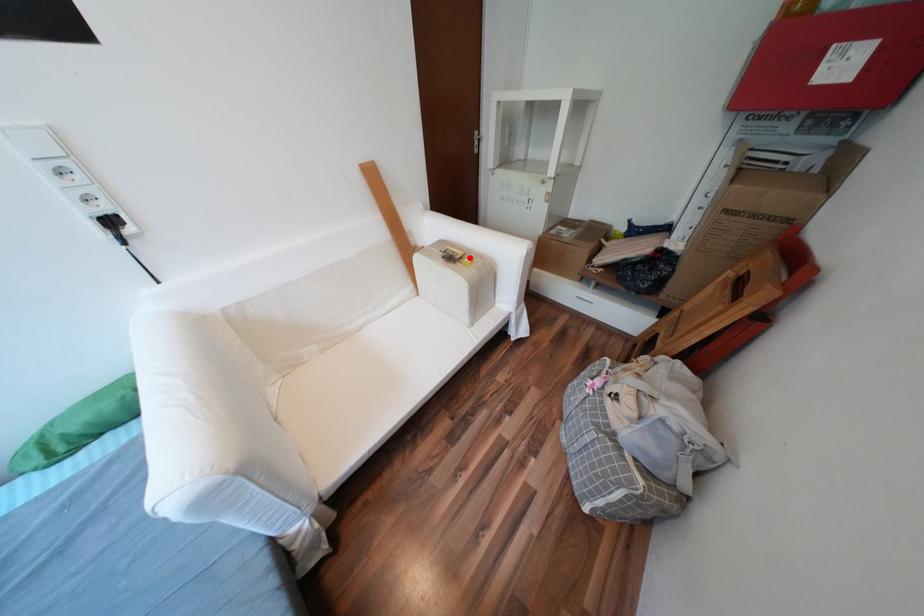
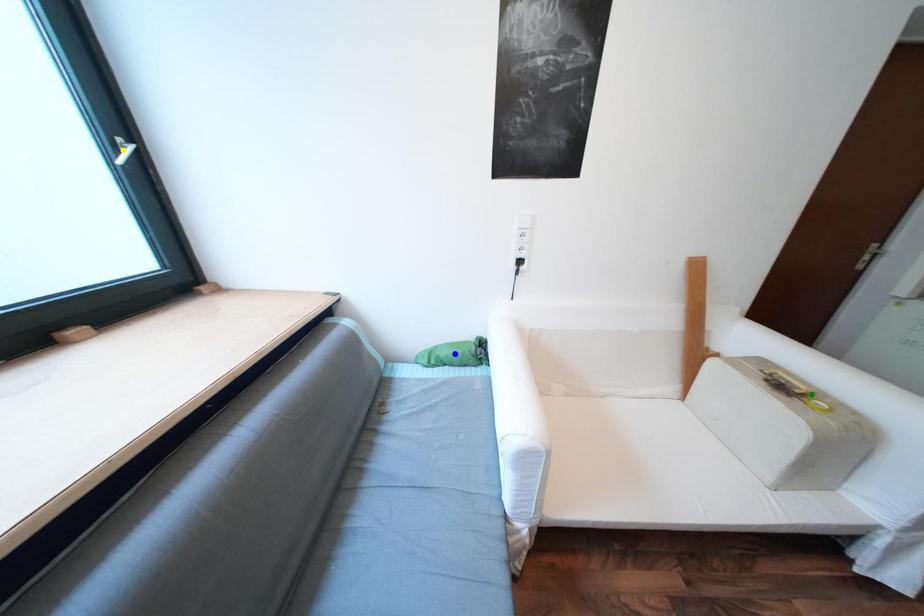
Question: I am providing you with two images of the same scene from different viewpoints. A red point is marked on the first image. You are given multiple points on the second image. In image 2, which mark is for the same physical point as the one in image 1?

Choices:
 (A) green point
 (B) yellow point
 (C) blue point

Answer: (A)